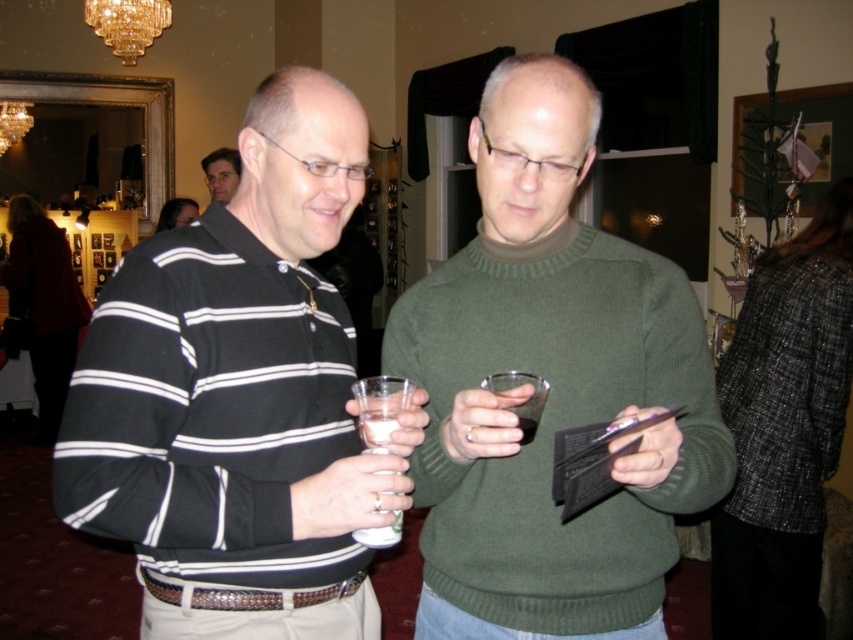
Question: Is crystal glass chandelier at upper center to the right of white opaque cup at center from the viewer's perspective?

Choices:
 (A) yes
 (B) no

Answer: (B)

Question: Which of the following is the farthest from the observer?

Choices:
 (A) black striped sweater at left
 (B) matte black sweater at upper left
 (C) white opaque cup at center

Answer: (B)

Question: Estimate the real-world distances between objects in this image. Which object is farther from the green wool sweater at center?

Choices:
 (A) black striped sweater at left
 (B) crystal glass chandelier at upper center
 (C) clear plastic cup at center
 (D) white opaque cup at center

Answer: (B)

Question: Is black striped sweater at left below crystal glass chandelier at upper center?

Choices:
 (A) yes
 (B) no

Answer: (A)

Question: Which of these objects is positioned closest to the translucent plastic cup at center?

Choices:
 (A) black striped sweater at left
 (B) white opaque cup at center
 (C) transparent glass at center
 (D) crystal glass chandelier at upper center

Answer: (C)

Question: Can you confirm if green wool sweater at center is positioned above clear plastic cup at center?

Choices:
 (A) no
 (B) yes

Answer: (B)